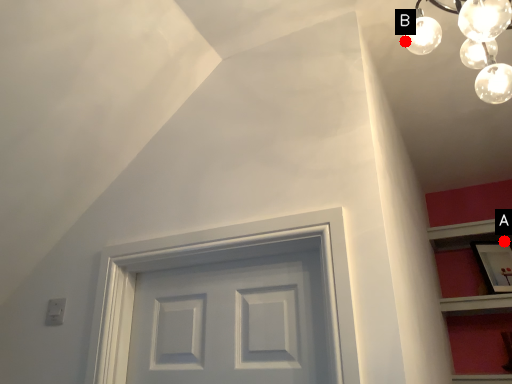
Question: Two points are circled on the image, labeled by A and B beside each circle. Which of the following is the farthest from the observer?

Choices:
 (A) A is further
 (B) B is further

Answer: (A)